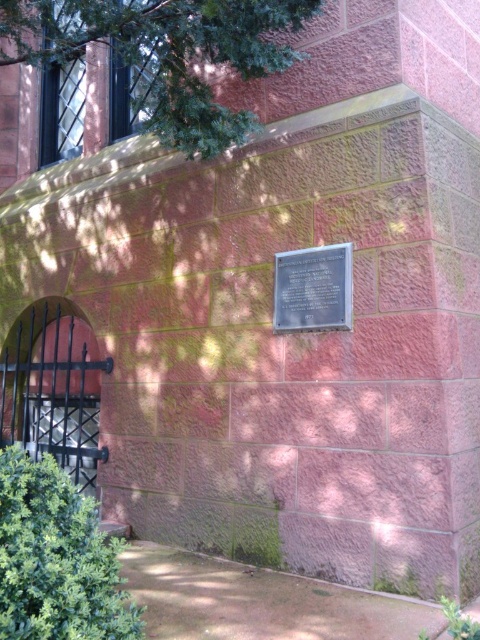
You are standing in front of the building and notice the green leafy tree at upper left and the metallic plaque at center. Which object is positioned to the left of the other?

The green leafy tree at upper left is positioned to the left of the metallic plaque at center.

You are standing in front of the building and want to trim the green leafy tree at upper left and the green leafy bush at lower left. Which one is closer to the ground?

The green leafy bush at lower left is closer to the ground since it is positioned below the green leafy tree at upper left.